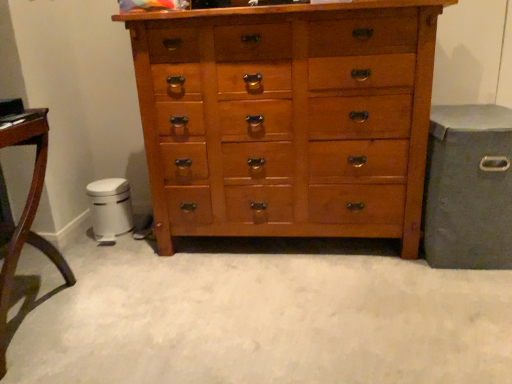
Question: Is wooden chest of drawers at center smaller than brushed metal trash can at lower left?

Choices:
 (A) yes
 (B) no

Answer: (B)

Question: From a real-world perspective, does wooden chest of drawers at center sit lower than brushed metal trash can at lower left?

Choices:
 (A) yes
 (B) no

Answer: (B)

Question: Is wooden chest of drawers at center in front of brushed metal trash can at lower left?

Choices:
 (A) yes
 (B) no

Answer: (A)

Question: Does wooden chest of drawers at center have a greater height compared to brushed metal trash can at lower left?

Choices:
 (A) yes
 (B) no

Answer: (A)

Question: Is brushed metal trash can at lower left surrounded by wooden chest of drawers at center?

Choices:
 (A) yes
 (B) no

Answer: (B)

Question: From the image's perspective, relative to wooden chest of drawers at center, is matte gray storage bin at right above or below?

Choices:
 (A) above
 (B) below

Answer: (B)

Question: Visually, is matte gray storage bin at right positioned to the left or to the right of wooden chest of drawers at center?

Choices:
 (A) right
 (B) left

Answer: (A)

Question: In the image, is matte gray storage bin at right positioned in front of or behind wooden chest of drawers at center?

Choices:
 (A) behind
 (B) front

Answer: (A)

Question: Considering the positions of matte gray storage bin at right and wooden chest of drawers at center in the image, is matte gray storage bin at right bigger or smaller than wooden chest of drawers at center?

Choices:
 (A) small
 (B) big

Answer: (A)

Question: From their relative heights in the image, would you say matte gray storage bin at right is taller or shorter than mahogany wood table at left?

Choices:
 (A) tall
 (B) short

Answer: (B)

Question: Considering the relative positions of matte gray storage bin at right and mahogany wood table at left in the image provided, is matte gray storage bin at right to the left or to the right of mahogany wood table at left?

Choices:
 (A) right
 (B) left

Answer: (A)

Question: Which is correct: matte gray storage bin at right is inside mahogany wood table at left, or outside of it?

Choices:
 (A) inside
 (B) outside

Answer: (B)

Question: Considering their positions, is matte gray storage bin at right located in front of or behind mahogany wood table at left?

Choices:
 (A) behind
 (B) front

Answer: (A)

Question: Considering the positions of brushed metal trash can at lower left and matte gray storage bin at right in the image, is brushed metal trash can at lower left wider or thinner than matte gray storage bin at right?

Choices:
 (A) wide
 (B) thin

Answer: (B)

Question: Considering the positions of brushed metal trash can at lower left and matte gray storage bin at right in the image, is brushed metal trash can at lower left taller or shorter than matte gray storage bin at right?

Choices:
 (A) short
 (B) tall

Answer: (A)